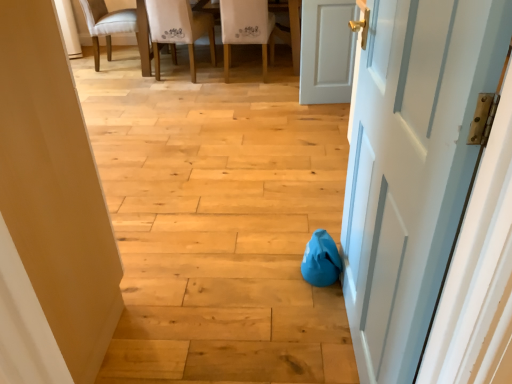
Locate an element on the screen. Image resolution: width=512 pixels, height=384 pixels. free spot to the left of white painted wood door at right, the second door from the right is located at coordinates (252, 327).